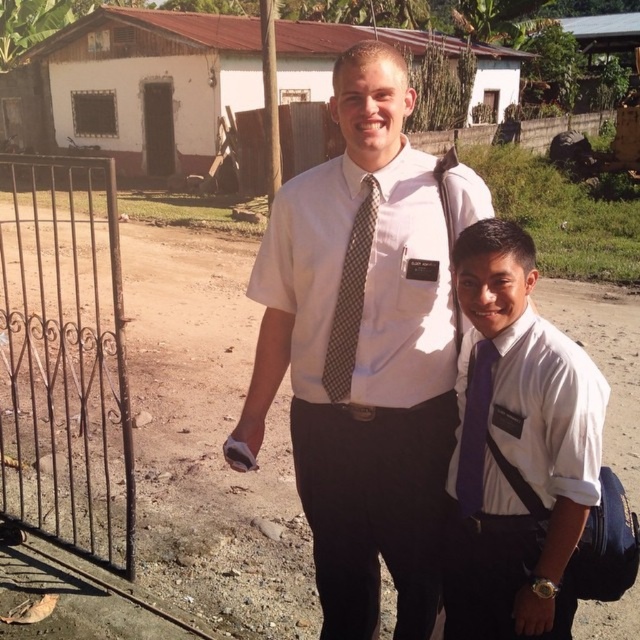
You are a tailor inspecting two purple ties on a mannequin. The two ties are labeled as the purple satin tie at right and the purple silk tie at right. Which one is positioned more to the right?

The purple satin tie at right is positioned more to the right than the purple silk tie at right.

You are a tailor measuring the height of the white shirt at center and the brown dotted tie at center for alterations. Which item has a greater height?

The white shirt at center has a greater height compared to the brown dotted tie at center.